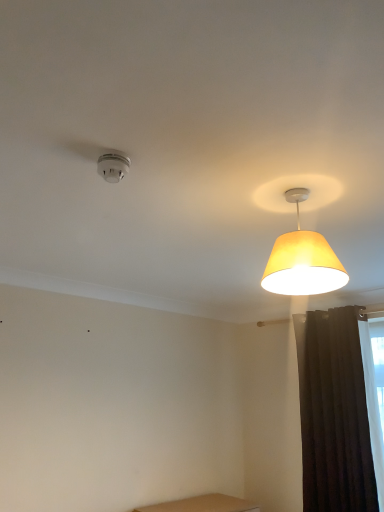
Describe the element at coordinates (334, 413) in the screenshot. I see `dark matte curtain at right` at that location.

The height and width of the screenshot is (512, 384). I want to click on dark matte curtain at right, so click(x=334, y=413).

In order to click on yellow fabric lampshade at upper right, which appears as the 2th lamp when viewed from the left in this screenshot , I will do `click(302, 260)`.

Is white plastic smoke detector at upper left, the 2th lamp viewed from the right, taller than dark matte curtain at right?

Incorrect, the height of white plastic smoke detector at upper left, the 2th lamp viewed from the right, is not larger of that of dark matte curtain at right.

Which is behind, point (102, 156) or point (344, 307)?

The point (344, 307) is more distant.

From a real-world perspective, is white plastic smoke detector at upper left, the first lamp viewed from the left, below dark matte curtain at right?

Actually, white plastic smoke detector at upper left, the first lamp viewed from the left, is physically above dark matte curtain at right in the real world.

Between white plastic smoke detector at upper left, the 2th lamp viewed from the right, and dark matte curtain at right, which one has larger width?

dark matte curtain at right is wider.

Could you tell me if yellow fabric lampshade at upper right, the 1th lamp from the right, is facing dark matte curtain at right?

No, yellow fabric lampshade at upper right, the 1th lamp from the right, does not turn towards dark matte curtain at right.

From the image's perspective, between yellow fabric lampshade at upper right, the 1th lamp from the right, and dark matte curtain at right, who is located below?

dark matte curtain at right, from the image's perspective.

Is yellow fabric lampshade at upper right, the 1th lamp from the right, far away from dark matte curtain at right?

Absolutely, yellow fabric lampshade at upper right, the 1th lamp from the right, is distant from dark matte curtain at right.

Considering the relative sizes of yellow fabric lampshade at upper right, which appears as the 2th lamp when viewed from the left, and white plastic smoke detector at upper left, the first lamp viewed from the left, in the image provided, is yellow fabric lampshade at upper right, which appears as the 2th lamp when viewed from the left, taller than white plastic smoke detector at upper left, the first lamp viewed from the left,?

Yes.

Is yellow fabric lampshade at upper right, the 1th lamp from the right, bigger or smaller than white plastic smoke detector at upper left, the first lamp viewed from the left?

Clearly, yellow fabric lampshade at upper right, the 1th lamp from the right, is larger in size than white plastic smoke detector at upper left, the first lamp viewed from the left.

Is white plastic smoke detector at upper left, the 2th lamp viewed from the right, located within yellow fabric lampshade at upper right, the 1th lamp from the right?

Actually, white plastic smoke detector at upper left, the 2th lamp viewed from the right, is outside yellow fabric lampshade at upper right, the 1th lamp from the right.

Does dark matte curtain at right appear on the left side of white plastic smoke detector at upper left, the first lamp viewed from the left?

Incorrect, dark matte curtain at right is not on the left side of white plastic smoke detector at upper left, the first lamp viewed from the left.

Does point (335, 349) lie in front of point (121, 167)?

No, it is not.

Are dark matte curtain at right and white plastic smoke detector at upper left, the 2th lamp viewed from the right, making contact?

dark matte curtain at right is not next to white plastic smoke detector at upper left, the 2th lamp viewed from the right, and they're not touching.

Is dark matte curtain at right inside or outside of white plastic smoke detector at upper left, the first lamp viewed from the left?

dark matte curtain at right is located beyond the bounds of white plastic smoke detector at upper left, the first lamp viewed from the left.

From the image's perspective, between white plastic smoke detector at upper left, the first lamp viewed from the left, and yellow fabric lampshade at upper right, which appears as the 2th lamp when viewed from the left, who is located below?

From the image's view, yellow fabric lampshade at upper right, which appears as the 2th lamp when viewed from the left, is below.

I want to click on lamp lying in front of the white plastic smoke detector at upper left, the first lamp viewed from the left, so click(x=302, y=260).

Does point (120, 162) come closer to viewer compared to point (303, 187)?

Yes, point (120, 162) is in front of point (303, 187).

In the scene shown: Looking at their sizes, would you say white plastic smoke detector at upper left, the 2th lamp viewed from the right, is wider or thinner than yellow fabric lampshade at upper right, the 1th lamp from the right?

white plastic smoke detector at upper left, the 2th lamp viewed from the right, is thinner than yellow fabric lampshade at upper right, the 1th lamp from the right.

Which object is wider, dark matte curtain at right or yellow fabric lampshade at upper right, which appears as the 2th lamp when viewed from the left?

Wider between the two is yellow fabric lampshade at upper right, which appears as the 2th lamp when viewed from the left.

Can you tell me how much dark matte curtain at right and yellow fabric lampshade at upper right, the 1th lamp from the right, differ in facing direction?

The facing directions of dark matte curtain at right and yellow fabric lampshade at upper right, the 1th lamp from the right, are 10 degrees apart.

Which is correct: dark matte curtain at right is inside yellow fabric lampshade at upper right, which appears as the 2th lamp when viewed from the left, or outside of it?

dark matte curtain at right is not enclosed by yellow fabric lampshade at upper right, which appears as the 2th lamp when viewed from the left.

From a real-world perspective, is dark matte curtain at right over yellow fabric lampshade at upper right, the 1th lamp from the right?

Actually, dark matte curtain at right is physically below yellow fabric lampshade at upper right, the 1th lamp from the right, in the real world.

Starting from the dark matte curtain at right, which lamp is the 2nd one to the left? Please provide its 2D coordinates.

[(113, 167)]

At what (x,y) coordinates should I click in order to perform the action: click on curtain below the yellow fabric lampshade at upper right, the 1th lamp from the right (from a real-world perspective). Please return your answer as a coordinate pair (x, y). The height and width of the screenshot is (512, 384). Looking at the image, I should click on (334, 413).

In the scene shown: Looking at the image, which one is located closer to white plastic smoke detector at upper left, the 2th lamp viewed from the right, dark matte curtain at right or yellow fabric lampshade at upper right, which appears as the 2th lamp when viewed from the left?

yellow fabric lampshade at upper right, which appears as the 2th lamp when viewed from the left, is closer to white plastic smoke detector at upper left, the 2th lamp viewed from the right.

Which object lies further to the anchor point dark matte curtain at right, white plastic smoke detector at upper left, the 2th lamp viewed from the right, or yellow fabric lampshade at upper right, which appears as the 2th lamp when viewed from the left?

Based on the image, white plastic smoke detector at upper left, the 2th lamp viewed from the right, appears to be further to dark matte curtain at right.

Estimate the real-world distances between objects in this image. Which object is further from yellow fabric lampshade at upper right, which appears as the 2th lamp when viewed from the left, dark matte curtain at right or white plastic smoke detector at upper left, the first lamp viewed from the left?

dark matte curtain at right is further to yellow fabric lampshade at upper right, which appears as the 2th lamp when viewed from the left.

In the scene shown: Considering their positions, is yellow fabric lampshade at upper right, the 1th lamp from the right, positioned closer to white plastic smoke detector at upper left, the 2th lamp viewed from the right, than dark matte curtain at right?

yellow fabric lampshade at upper right, the 1th lamp from the right, is positioned closer to the anchor white plastic smoke detector at upper left, the 2th lamp viewed from the right.

When comparing their distances from yellow fabric lampshade at upper right, the 1th lamp from the right, does white plastic smoke detector at upper left, the 2th lamp viewed from the right, or dark matte curtain at right seem closer?

Based on the image, white plastic smoke detector at upper left, the 2th lamp viewed from the right, appears to be nearer to yellow fabric lampshade at upper right, the 1th lamp from the right.

Which object lies further to the anchor point dark matte curtain at right, yellow fabric lampshade at upper right, which appears as the 2th lamp when viewed from the left, or white plastic smoke detector at upper left, the first lamp viewed from the left?

Based on the image, white plastic smoke detector at upper left, the first lamp viewed from the left, appears to be further to dark matte curtain at right.

What are the coordinates of `lamp between white plastic smoke detector at upper left, the 2th lamp viewed from the right, and dark matte curtain at right in the up-down direction` in the screenshot? It's located at (302, 260).